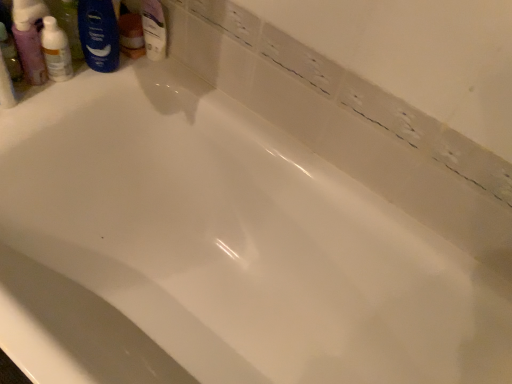
The image size is (512, 384). What do you see at coordinates (56, 51) in the screenshot? I see `translucent plastic bottle at upper left` at bounding box center [56, 51].

Where is `translucent plastic bottle at upper left`? translucent plastic bottle at upper left is located at coordinates (56, 51).

From a real-world perspective, is translucent plastic mouthwash at upper left below blue matte shaving cream at upper left?

Yes, from a real-world perspective, translucent plastic mouthwash at upper left is below blue matte shaving cream at upper left.

Are translucent plastic mouthwash at upper left and blue matte shaving cream at upper left far apart?

translucent plastic mouthwash at upper left is near blue matte shaving cream at upper left, not far away.

Which of these two, translucent plastic mouthwash at upper left or blue matte shaving cream at upper left, is smaller?

Smaller between the two is translucent plastic mouthwash at upper left.

Could you tell me if blue matte shaving cream at upper left is facing translucent plastic mouthwash at upper left?

No, blue matte shaving cream at upper left is not aimed at translucent plastic mouthwash at upper left.

Which of these two, blue matte shaving cream at upper left or translucent plastic mouthwash at upper left, is bigger?

blue matte shaving cream at upper left.

How distant is blue matte shaving cream at upper left from translucent plastic mouthwash at upper left?

blue matte shaving cream at upper left and translucent plastic mouthwash at upper left are 4.99 inches apart from each other.

Is blue matte shaving cream at upper left next to translucent plastic mouthwash at upper left?

blue matte shaving cream at upper left and translucent plastic mouthwash at upper left are not in contact.

Is translucent plastic bottle at upper left not close to translucent plastic mouthwash at upper left?

translucent plastic bottle at upper left is actually quite close to translucent plastic mouthwash at upper left.

Consider the image. Does translucent plastic bottle at upper left appear on the left side of translucent plastic mouthwash at upper left?

In fact, translucent plastic bottle at upper left is to the right of translucent plastic mouthwash at upper left.

Is translucent plastic bottle at upper left oriented away from translucent plastic mouthwash at upper left?

No.

Who is smaller, translucent plastic bottle at upper left or translucent plastic mouthwash at upper left?

translucent plastic mouthwash at upper left is smaller.

Is translucent plastic bottle at upper left directly adjacent to blue matte shaving cream at upper left?

Yes, translucent plastic bottle at upper left is right next to blue matte shaving cream at upper left and making contact.

Locate an element on the screen. The width and height of the screenshot is (512, 384). shaving cream above the translucent plastic bottle at upper left (from a real-world perspective) is located at coordinates tap(99, 34).

In the scene shown: Is translucent plastic bottle at upper left facing towards blue matte shaving cream at upper left?

No, translucent plastic bottle at upper left does not turn towards blue matte shaving cream at upper left.

Which of these two, translucent plastic bottle at upper left or blue matte shaving cream at upper left, is smaller?

translucent plastic bottle at upper left is smaller.

Locate an element on the screen. This screenshot has height=384, width=512. toiletry that is under the blue matte shaving cream at upper left (from a real-world perspective) is located at coordinates (56, 51).

Does point (104, 25) appear closer or farther from the camera than point (73, 74)?

Point (104, 25).

In the scene shown: From the image's perspective, who appears lower, blue matte shaving cream at upper left or translucent plastic bottle at upper left?

translucent plastic bottle at upper left.

Considering the sizes of objects blue matte shaving cream at upper left and translucent plastic bottle at upper left in the image provided, who is shorter, blue matte shaving cream at upper left or translucent plastic bottle at upper left?

With less height is translucent plastic bottle at upper left.

Who is smaller, translucent plastic mouthwash at upper left or translucent plastic bottle at upper left?

translucent plastic mouthwash at upper left.

Is translucent plastic mouthwash at upper left facing towards translucent plastic bottle at upper left?

No, translucent plastic mouthwash at upper left is not turned towards translucent plastic bottle at upper left.

Do you think translucent plastic mouthwash at upper left is within translucent plastic bottle at upper left, or outside of it?

translucent plastic mouthwash at upper left lies outside translucent plastic bottle at upper left.

How distant is translucent plastic mouthwash at upper left from translucent plastic bottle at upper left?

translucent plastic mouthwash at upper left is 1.19 inches from translucent plastic bottle at upper left.

The width and height of the screenshot is (512, 384). In order to click on mouthwash that appears below the blue matte shaving cream at upper left (from the image's perspective) in this screenshot , I will do pyautogui.click(x=29, y=46).

Locate an element on the screen. The image size is (512, 384). mouthwash located on the left of blue matte shaving cream at upper left is located at coordinates (29, 46).

Looking at the image, which one is located closer to blue matte shaving cream at upper left, translucent plastic bottle at upper left or translucent plastic mouthwash at upper left?

translucent plastic bottle at upper left.

In the scene shown: Which object lies further to the anchor point translucent plastic mouthwash at upper left, blue matte shaving cream at upper left or translucent plastic bottle at upper left?

blue matte shaving cream at upper left is positioned further to the anchor translucent plastic mouthwash at upper left.

When comparing their distances from blue matte shaving cream at upper left, does translucent plastic mouthwash at upper left or translucent plastic bottle at upper left seem further?

Based on the image, translucent plastic mouthwash at upper left appears to be further to blue matte shaving cream at upper left.

Considering their positions, is translucent plastic mouthwash at upper left positioned closer to translucent plastic bottle at upper left than blue matte shaving cream at upper left?

translucent plastic mouthwash at upper left.

Which object lies further to the anchor point translucent plastic bottle at upper left, blue matte shaving cream at upper left or translucent plastic mouthwash at upper left?

Based on the image, blue matte shaving cream at upper left appears to be further to translucent plastic bottle at upper left.

Which object lies further to the anchor point translucent plastic mouthwash at upper left, translucent plastic bottle at upper left or blue matte shaving cream at upper left?

Based on the image, blue matte shaving cream at upper left appears to be further to translucent plastic mouthwash at upper left.

You are a GUI agent. You are given a task and a screenshot of the screen. Output one action in this format:
    pyautogui.click(x=<x>, y=<y>)
    Task: Click on the toiletry between translucent plastic mouthwash at upper left and blue matte shaving cream at upper left
    This screenshot has width=512, height=384.
    Given the screenshot: What is the action you would take?
    pyautogui.click(x=56, y=51)